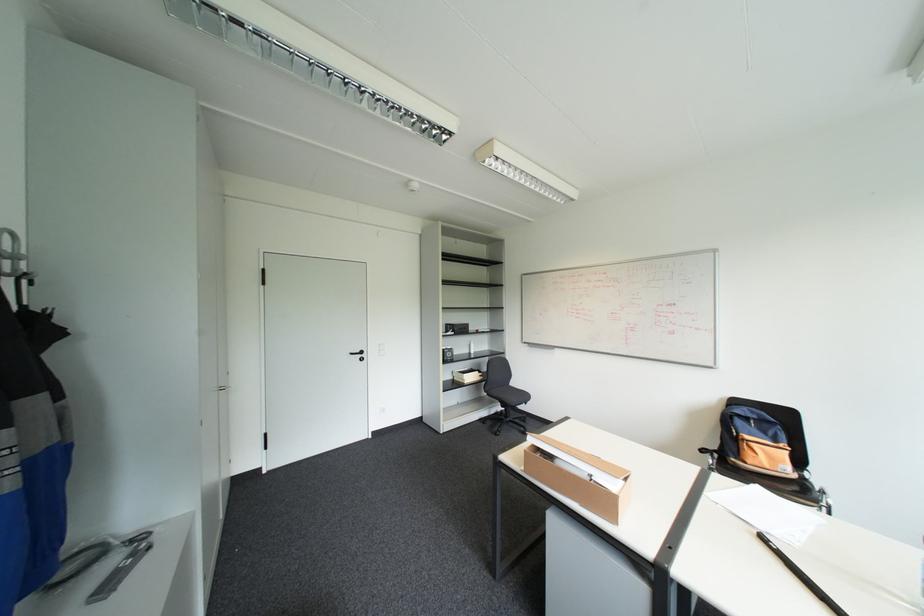
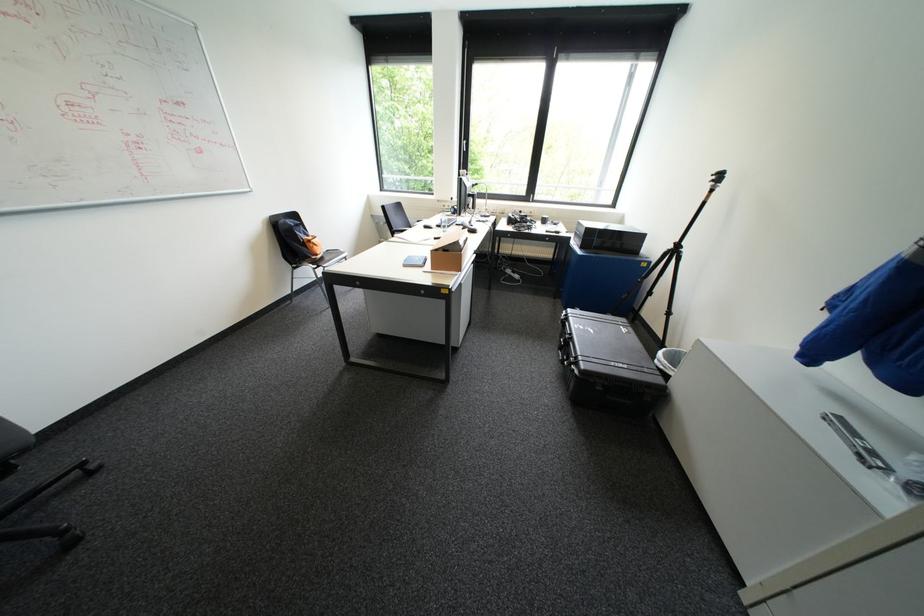
Question: I am providing you with two images of the same scene from different viewpoints. Please identify which objects are invisible in image2.

Choices:
 (A) small blue book
 (B) small wooden tray
 (C) black case handle
 (D) pink spray bottle

Answer: (B)